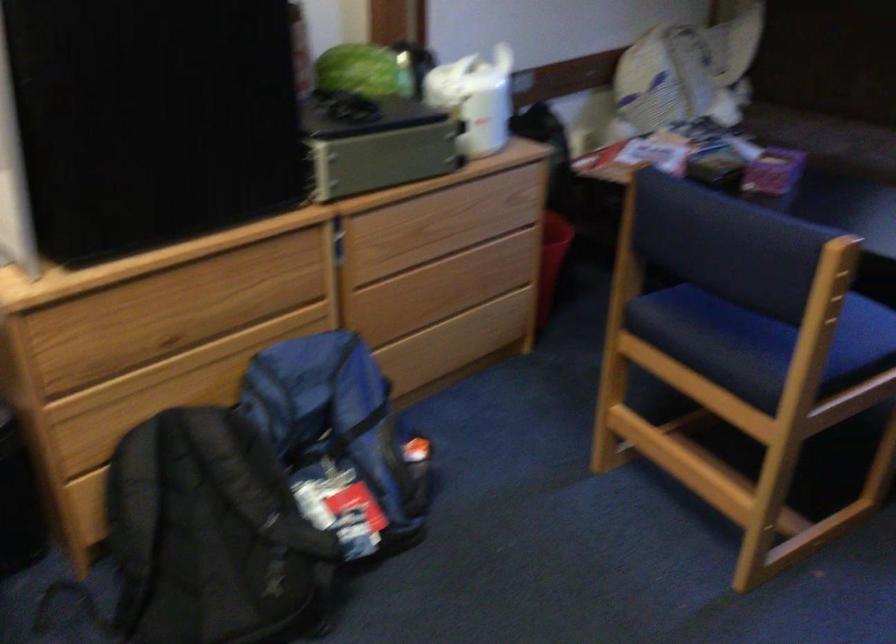
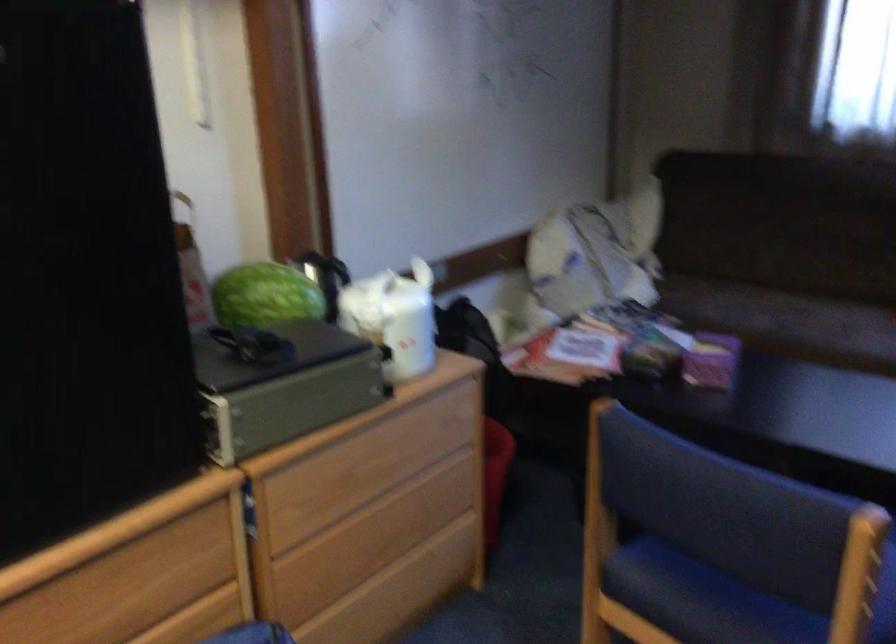
Find the pixel in the second image that matches (234,234) in the first image.

(116, 531)